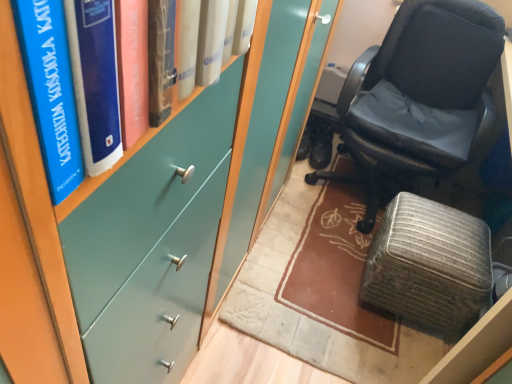
Question: Can you confirm if teal matte bookshelf at upper left is positioned to the right of black leather shoes at center?

Choices:
 (A) no
 (B) yes

Answer: (A)

Question: Is teal matte bookshelf at upper left beside black leather shoes at center?

Choices:
 (A) yes
 (B) no

Answer: (B)

Question: Is teal matte bookshelf at upper left far from black leather shoes at center?

Choices:
 (A) no
 (B) yes

Answer: (B)

Question: Is teal matte bookshelf at upper left turned away from black leather shoes at center?

Choices:
 (A) yes
 (B) no

Answer: (B)

Question: Considering the relative sizes of teal matte bookshelf at upper left and black leather shoes at center in the image provided, is teal matte bookshelf at upper left shorter than black leather shoes at center?

Choices:
 (A) yes
 (B) no

Answer: (B)

Question: In the image, is textured gray ottoman at lower right positioned in front of or behind teal matte bookshelf at upper left?

Choices:
 (A) behind
 (B) front

Answer: (A)

Question: Is textured gray ottoman at lower right situated inside teal matte bookshelf at upper left or outside?

Choices:
 (A) inside
 (B) outside

Answer: (B)

Question: Is point (407, 281) positioned closer to the camera than point (5, 100)?

Choices:
 (A) farther
 (B) closer

Answer: (A)

Question: From a real-world perspective, relative to teal matte bookshelf at upper left, is textured gray ottoman at lower right vertically above or below?

Choices:
 (A) above
 (B) below

Answer: (B)

Question: From the image's perspective, is black leather chair at right located above or below teal matte bookshelf at upper left?

Choices:
 (A) above
 (B) below

Answer: (A)

Question: Is black leather chair at right inside the boundaries of teal matte bookshelf at upper left, or outside?

Choices:
 (A) inside
 (B) outside

Answer: (B)

Question: Is black leather chair at right bigger or smaller than teal matte bookshelf at upper left?

Choices:
 (A) small
 (B) big

Answer: (B)

Question: In the image, is black leather chair at right on the left side or the right side of teal matte bookshelf at upper left?

Choices:
 (A) left
 (B) right

Answer: (B)

Question: Is teal matte bookshelf at upper left to the left or to the right of black leather chair at right in the image?

Choices:
 (A) left
 (B) right

Answer: (A)

Question: Is teal matte bookshelf at upper left wider or thinner than black leather chair at right?

Choices:
 (A) thin
 (B) wide

Answer: (A)